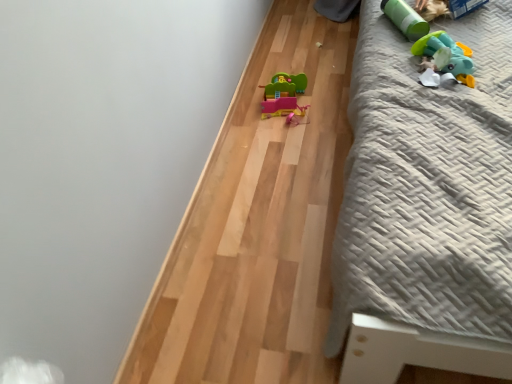
Question: Is the surface of matte plastic toy car at center, which appears as the first toy when viewed from the left, in direct contact with green matte cylinder at upper right, which is counted as the 2th toy, starting from the right?

Choices:
 (A) yes
 (B) no

Answer: (B)

Question: Does matte plastic toy car at center, the third toy from the front, have a smaller size compared to green matte cylinder at upper right, acting as the 2th toy starting from the left?

Choices:
 (A) yes
 (B) no

Answer: (B)

Question: Considering the relative positions of matte plastic toy car at center, which is the 1th toy in back-to-front order, and green matte cylinder at upper right, which is counted as the 2th toy, starting from the right, in the image provided, is matte plastic toy car at center, which is the 1th toy in back-to-front order, behind green matte cylinder at upper right, which is counted as the 2th toy, starting from the right,?

Choices:
 (A) yes
 (B) no

Answer: (A)

Question: Does matte plastic toy car at center, arranged as the third toy when viewed from the right, turn towards green matte cylinder at upper right, acting as the second toy starting from the back?

Choices:
 (A) yes
 (B) no

Answer: (B)

Question: From a real-world perspective, is matte plastic toy car at center, the third toy from the front, physically below green matte cylinder at upper right, which is counted as the 2th toy, starting from the right?

Choices:
 (A) yes
 (B) no

Answer: (A)

Question: Is matte plastic toy car at center, the third toy from the front, taller than green matte cylinder at upper right, acting as the second toy starting from the back?

Choices:
 (A) no
 (B) yes

Answer: (B)

Question: Considering the relative positions of rubber duck at upper right, which appears as the 3th toy when viewed from the back, and gray textured bed at right in the image provided, is rubber duck at upper right, which appears as the 3th toy when viewed from the back, to the left of gray textured bed at right from the viewer's perspective?

Choices:
 (A) yes
 (B) no

Answer: (A)

Question: Can you confirm if rubber duck at upper right, which is counted as the first toy, starting from the front, is positioned to the right of gray textured bed at right?

Choices:
 (A) no
 (B) yes

Answer: (A)

Question: From a real-world perspective, is rubber duck at upper right, the third toy positioned from the left, located higher than gray textured bed at right?

Choices:
 (A) yes
 (B) no

Answer: (A)

Question: Is rubber duck at upper right, the third toy positioned from the left, not inside gray textured bed at right?

Choices:
 (A) yes
 (B) no

Answer: (B)

Question: From a real-world perspective, is rubber duck at upper right, the third toy positioned from the left, positioned under gray textured bed at right based on gravity?

Choices:
 (A) no
 (B) yes

Answer: (A)

Question: Does rubber duck at upper right, which is counted as the first toy, starting from the front, lie behind gray textured bed at right?

Choices:
 (A) yes
 (B) no

Answer: (A)

Question: From the image's perspective, is matte plastic toy car at center, which appears as the first toy when viewed from the left, below rubber duck at upper right, the third toy positioned from the left?

Choices:
 (A) no
 (B) yes

Answer: (B)